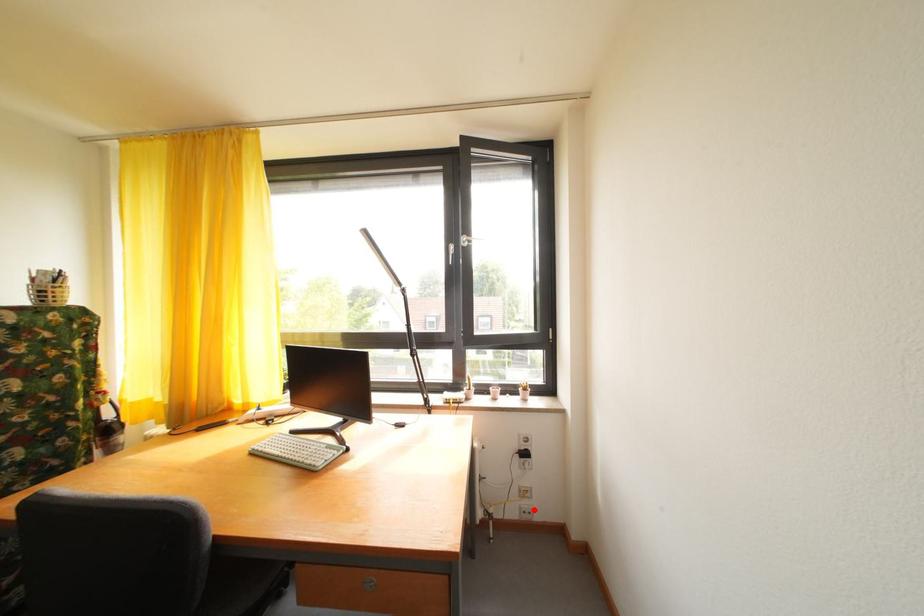
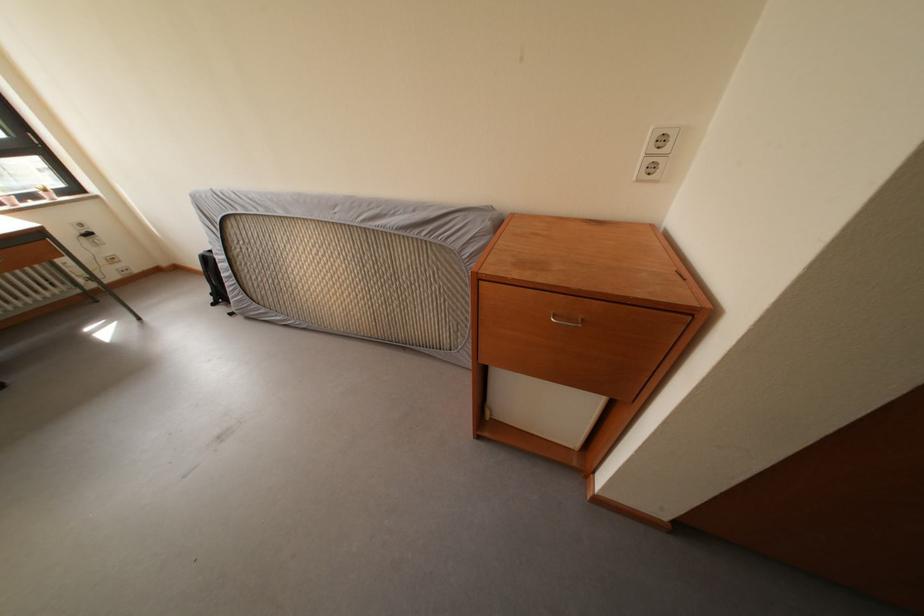
Question: I am providing you with two images of the same scene from different viewpoints. Given a red point in image1, look at the same physical point in image2. Is it:

Choices:
 (A) Closer to the viewpoint
 (B) Farther from the viewpoint

Answer: (A)